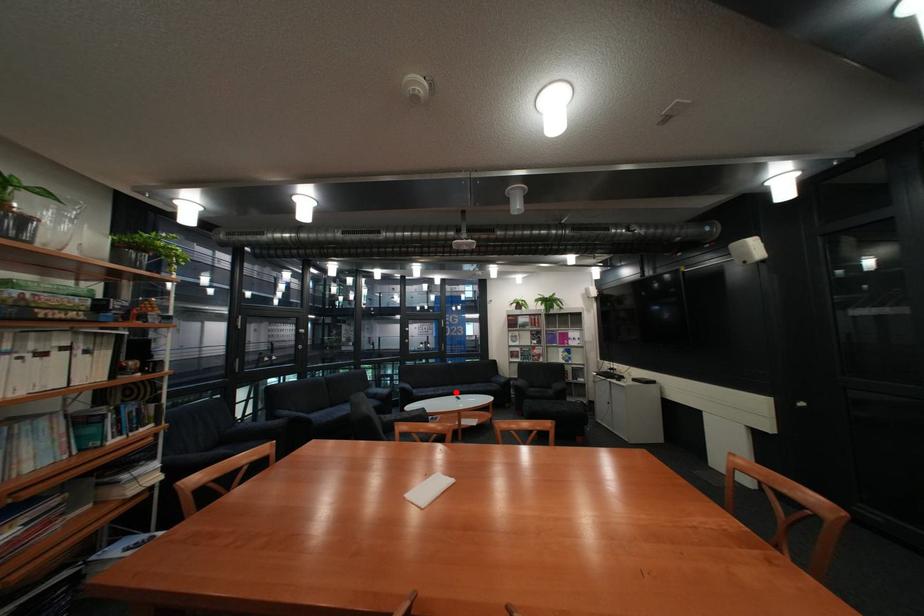
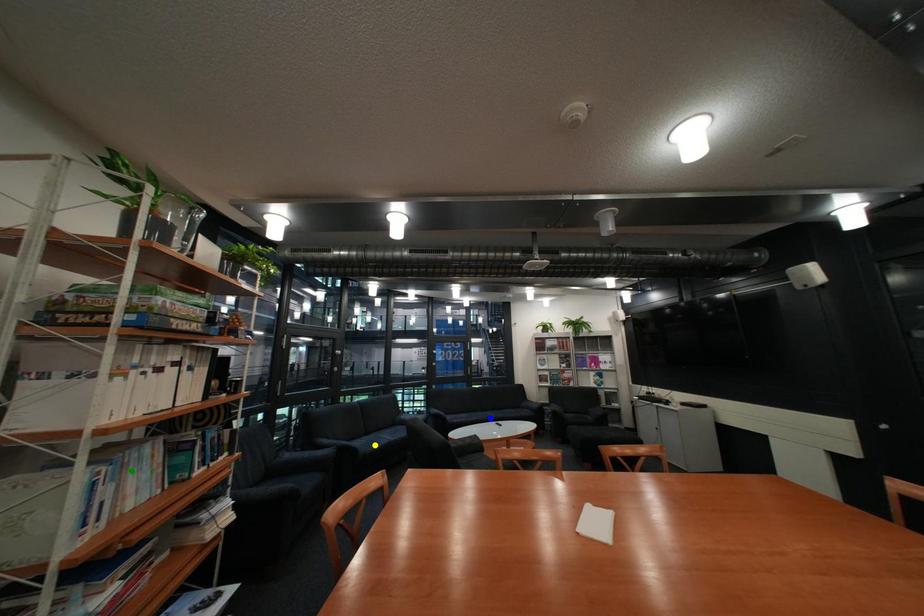
Question: I am providing you with two images of the same scene from different viewpoints. A red point is marked on the first image. You are given multiple points on the second image. Which mark in image 2 goes with the point in image 1?

Choices:
 (A) green point
 (B) blue point
 (C) yellow point

Answer: (B)